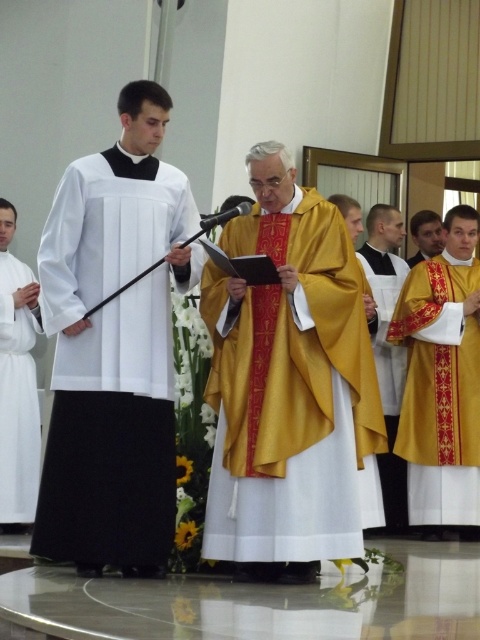
You are a photographer positioned between the gold embroidered robe at right and the white matte robe at left. You need to capture a photo that includes both robes clearly. Given that your camera has a maximum focus range of 4 meters, will you be able to capture both robes in focus at the same time?

The distance between the gold embroidered robe at right and the white matte robe at left is 3.96 meters, which is within the camera maximum focus range of 4 meters. Therefore, you can capture both robes in focus simultaneously.

What is the spatial relationship between the gold satin robe at center and the other objects in the scene?

The gold satin robe at center is positioned at coordinates point (x=291, y=394).

You are an attendee at the ceremony and need to locate the altar. The altar is positioned at the highest point in the room. Based on the positions of the gold satin robe at center and the gold satin robe at right, which one is closer to the altar?

The gold satin robe at right is closer to the altar because it is positioned higher than the gold satin robe at center, and the altar is at the highest point in the room.